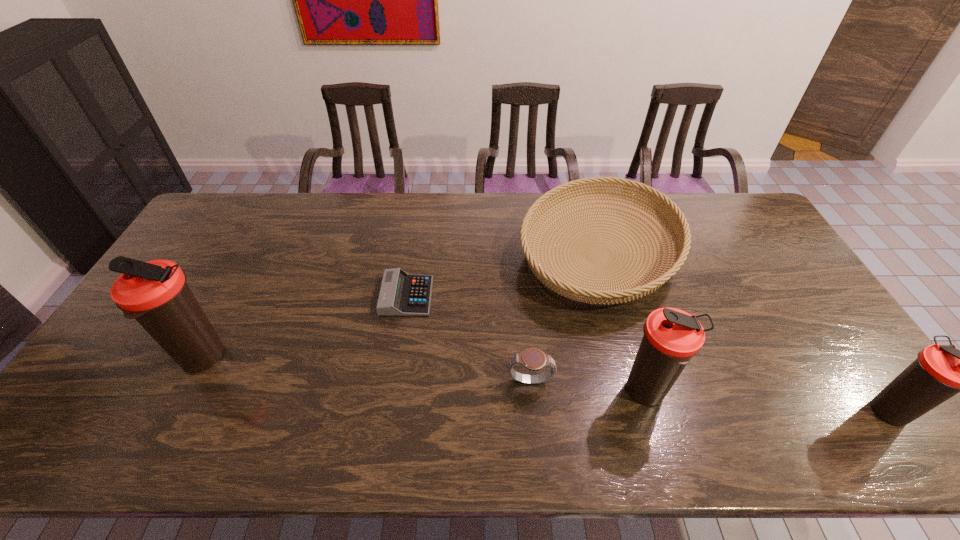
Identify the location of vacant space at the near edge of the desktop. This screenshot has width=960, height=540. (772, 403).

In the image, there is a desktop. Identify the location of vacant space at the far left corner. (220, 213).

The image size is (960, 540). In order to click on vacant space at the far right corner of the desktop in this screenshot , I will do `click(742, 201)`.

What are the coordinates of `free space at the near right corner of the desktop` in the screenshot? It's located at (813, 392).

Where is `vacant area between the second thermos bottle from left to right and the leftmost thermos bottle`? This screenshot has height=540, width=960. vacant area between the second thermos bottle from left to right and the leftmost thermos bottle is located at coordinates (425, 375).

Find the location of a particular element. The height and width of the screenshot is (540, 960). free space between the second thermos bottle from right to left and the leftmost thermos bottle is located at coordinates (425, 375).

This screenshot has width=960, height=540. Find the location of `free spot between the shortest thermos bottle and the leftmost thermos bottle`. free spot between the shortest thermos bottle and the leftmost thermos bottle is located at coordinates (547, 384).

Locate an element on the screen. free space between the rightmost thermos bottle and the basket is located at coordinates (745, 333).

I want to click on free space that is in between the watch and the basket, so click(564, 318).

This screenshot has height=540, width=960. Identify the location of vacant area that lies between the shortest object and the basket. (503, 275).